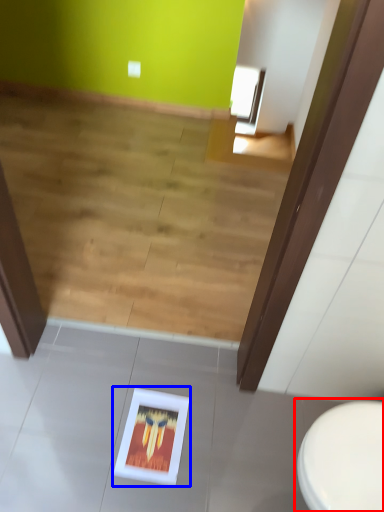
Question: Which object is closer to the camera taking this photo, toilet (highlighted by a red box) or picture frame (highlighted by a blue box)?

Choices:
 (A) toilet
 (B) picture frame

Answer: (A)